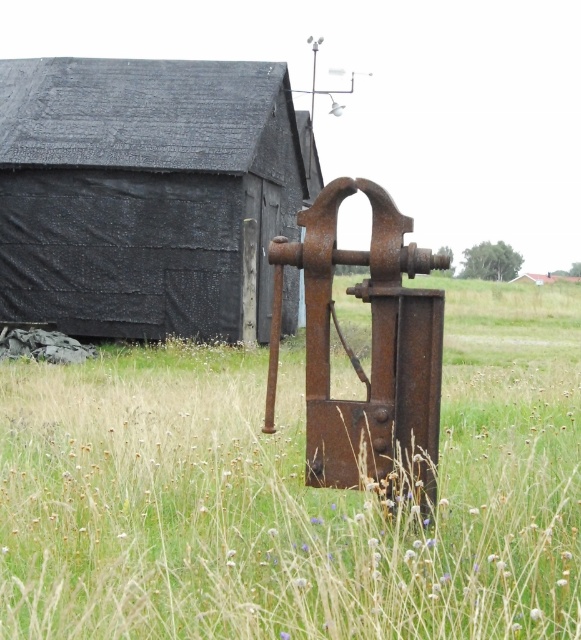
In the scene shown: Which is more to the left, dry grass at center or rusty metal barn at center?

From the viewer's perspective, rusty metal barn at center appears more on the left side.

Is dry grass at center to the left of rusty metal barn at center from the viewer's perspective?

Incorrect, dry grass at center is not on the left side of rusty metal barn at center.

Is point (135, 536) closer to viewer compared to point (210, 113)?

Yes, it is in front of point (210, 113).

At what (x,y) coordinates should I click in order to perform the action: click on dry grass at center. Please return your answer as a coordinate pair (x, y). This screenshot has width=581, height=640. Looking at the image, I should click on (292, 493).